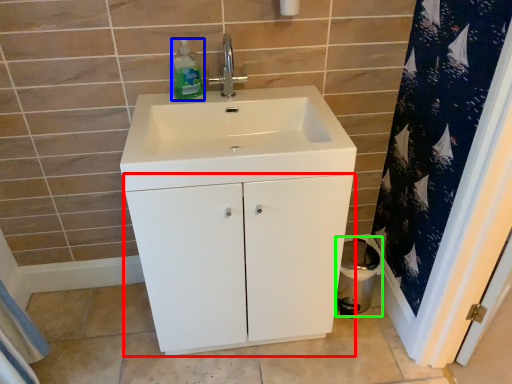
Question: Considering the real-world distances, which object is farthest from bathroom cabinet (highlighted by a red box)? cleaning product (highlighted by a blue box) or toilet bowl (highlighted by a green box)?

Choices:
 (A) cleaning product
 (B) toilet bowl

Answer: (A)